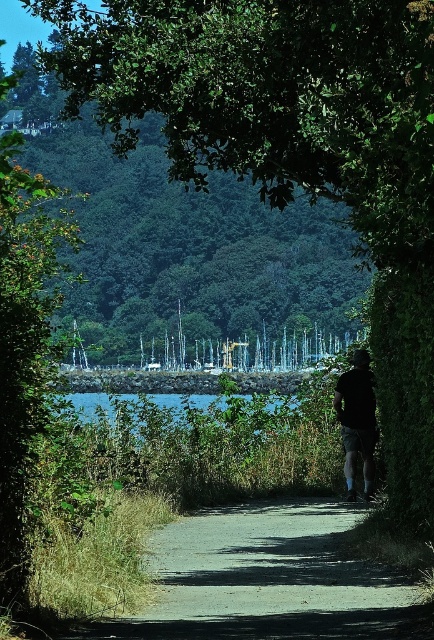
Question: Is gray gravel path at center to the left of blue water at center from the viewer's perspective?

Choices:
 (A) no
 (B) yes

Answer: (A)

Question: Can you confirm if gray gravel path at center is thinner than black cotton shirt at center?

Choices:
 (A) no
 (B) yes

Answer: (A)

Question: Is black cotton shirt at center to the left of blue water at center from the viewer's perspective?

Choices:
 (A) yes
 (B) no

Answer: (B)

Question: Which is farther from the blue water at center?

Choices:
 (A) black cotton shirt at center
 (B) gray gravel path at center

Answer: (A)

Question: Which object appears farthest from the camera in this image?

Choices:
 (A) blue water at center
 (B) black cotton shirt at center

Answer: (B)

Question: Which of the following is the farthest from the observer?

Choices:
 (A) black cotton shirt at center
 (B) blue water at center

Answer: (A)